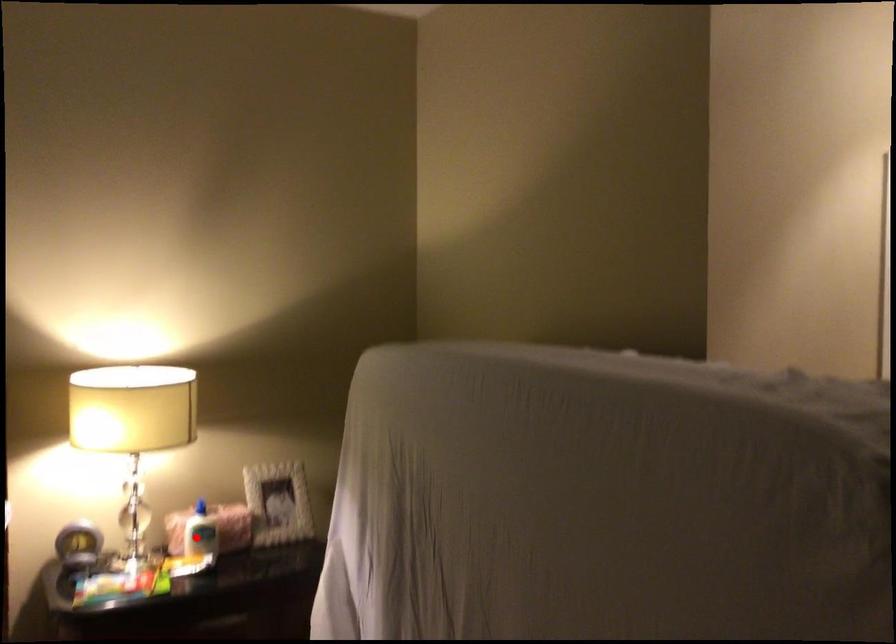
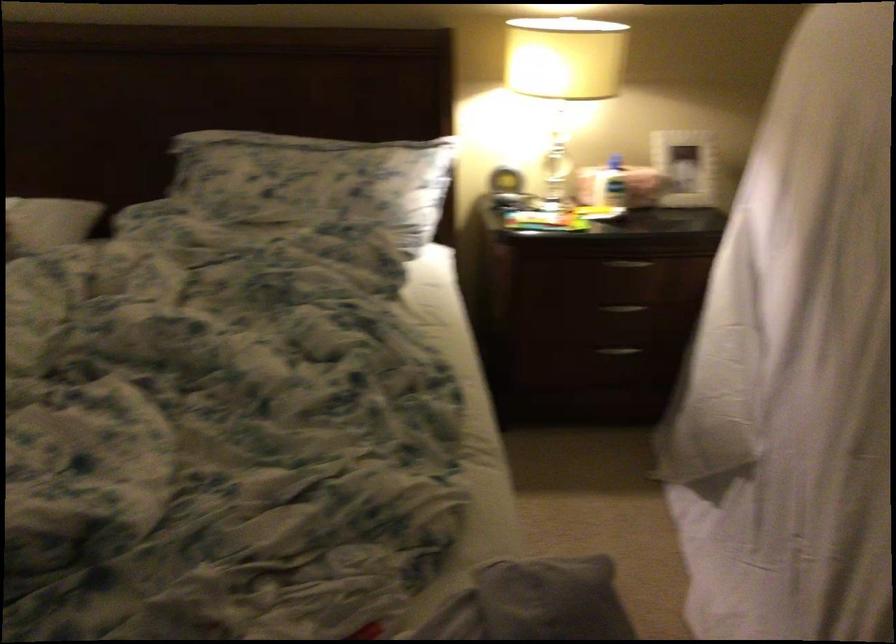
In the second image, find the point that corresponds to the highlighted location in the first image.

(609, 184)